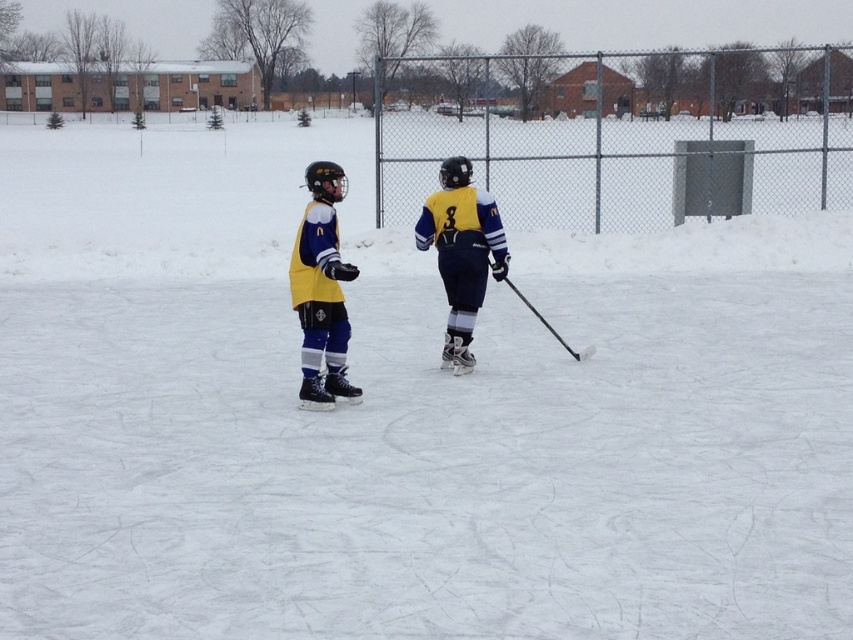
You are a referee at a hockey game and need to identify the tallest jersey among the two players wearing yellow. Which one is taller? The players are the yellow matte hockey jersey at center and the yellow jersey at center.

The yellow matte hockey jersey at center is taller than the yellow jersey at center.

You are a coach observing two hockey players on the ice. You notice the yellow matte hockey jersey at center and the yellow jersey at center. Which one is larger in size?

The yellow matte hockey jersey at center is bigger than the yellow jersey at center.

You are a referee on the ice rink. You need to ensure players are spaced at least 5 feet apart for safety. Can you confirm if the distance between the yellow matte hockey jersey at center and the yellow jersey at center meets the requirement?

The distance between the yellow matte hockey jersey at center and the yellow jersey at center is 4.59 feet, which is less than the required 5 feet. Therefore, they are too close and do not meet the safety requirement.